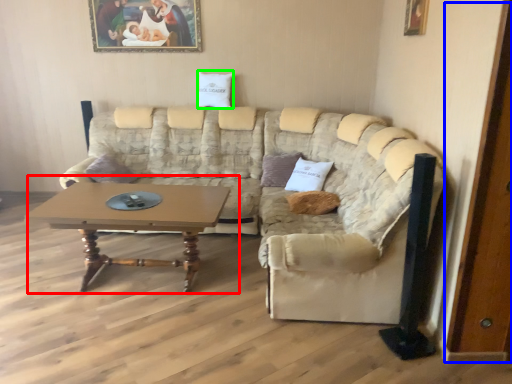
Question: Estimate the real-world distances between objects in this image. Which object is farther from coffee table (highlighted by a red box), door (highlighted by a blue box) or pillow (highlighted by a green box)?

Choices:
 (A) door
 (B) pillow

Answer: (A)